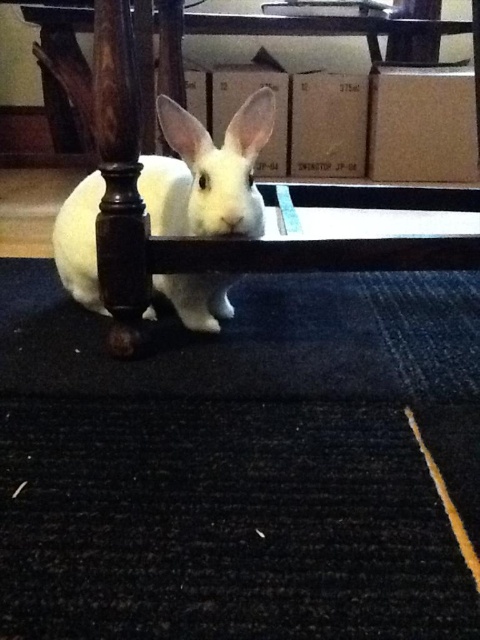
You are a pet owner who wants to place a 10 inch long toy for your rabbit. The toy needs to be placed between the black textured mat at lower center and the white soft fur rabbit at center. Is there enough space to place the toy without overlapping either object?

The black textured mat at lower center is 8.46 inches from the white soft fur rabbit at center. Since the toy is 10 inches long, there isn not enough space between them to place the toy without overlapping either object.

You are a cleaning robot that needs to move from the black textured mat at lower center to the white soft fur rabbit at center. Which object should you avoid stepping on?

The white soft fur rabbit at center is smaller than the black textured mat at lower center, so you should avoid stepping on the white soft fur rabbit at center to prevent harming it.